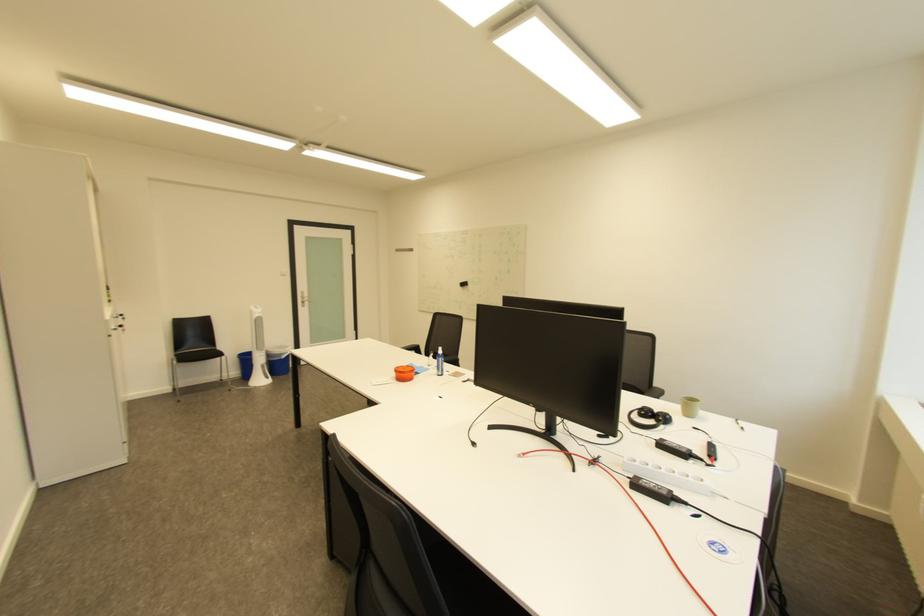
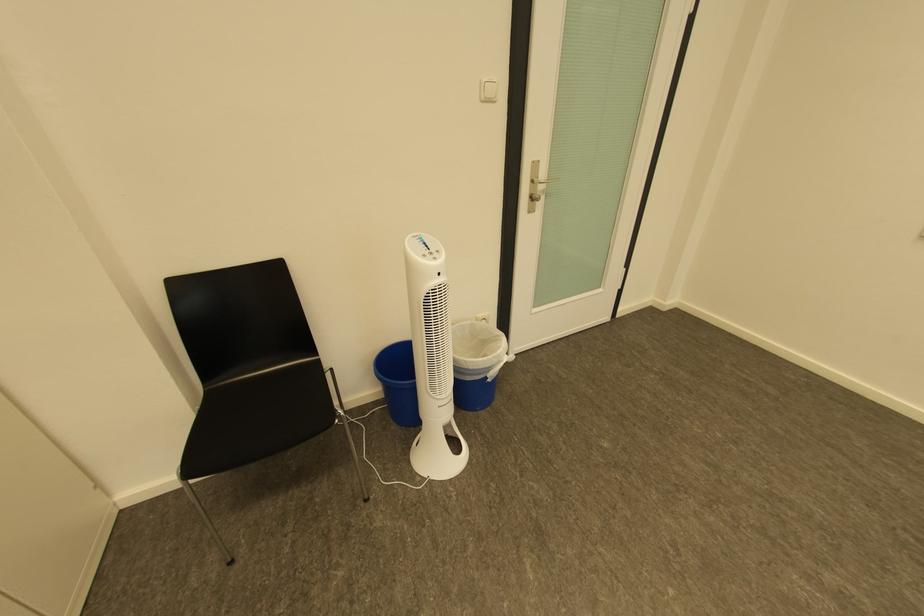
The point at (293, 355) is marked in the first image. Where is the corresponding point in the second image?

(499, 370)